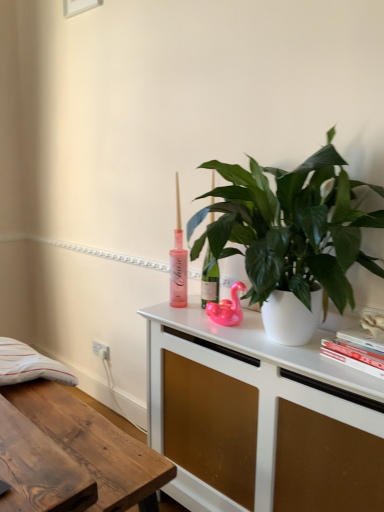
Image resolution: width=384 pixels, height=512 pixels. What do you see at coordinates (290, 234) in the screenshot? I see `green glossy plant at center` at bounding box center [290, 234].

This screenshot has width=384, height=512. What do you see at coordinates (227, 308) in the screenshot?
I see `pink rubber duck at center` at bounding box center [227, 308].

The height and width of the screenshot is (512, 384). What do you see at coordinates (101, 350) in the screenshot?
I see `white plastic electric outlet at lower left` at bounding box center [101, 350].

Identify the location of hardcover book at right. (354, 354).

This screenshot has width=384, height=512. Identify the location of green glossy plant at center. (290, 234).

Which is more to the right, wooden desk at lower left or hardcover book at right?

hardcover book at right.

Which of these two, wooden desk at lower left or hardcover book at right, stands shorter?

Standing shorter between the two is hardcover book at right.

Is wooden desk at lower left aimed at hardcover book at right?

No, wooden desk at lower left is not facing towards hardcover book at right.

Is point (59, 399) closer to camera compared to point (344, 350)?

No, (59, 399) is behind (344, 350).

Is there a large distance between pink rubber duck at center and white matte cabinet at center?

No, pink rubber duck at center is in close proximity to white matte cabinet at center.

From a real-world perspective, between pink rubber duck at center and white matte cabinet at center, who is vertically lower?

white matte cabinet at center, from a real-world perspective.

Between pink rubber duck at center and white matte cabinet at center, which one appears on the left side from the viewer's perspective?

pink rubber duck at center is more to the left.

Measure the distance between pink rubber duck at center and white matte cabinet at center.

A distance of 37.08 centimeters exists between pink rubber duck at center and white matte cabinet at center.

Is white plastic electric outlet at lower left spatially inside pink rubber duck at center, or outside of it?

white plastic electric outlet at lower left is outside pink rubber duck at center.

From the image's perspective, which one is positioned lower, white plastic electric outlet at lower left or pink rubber duck at center?

From the image's view, white plastic electric outlet at lower left is below.

Is white plastic electric outlet at lower left facing towards pink rubber duck at center?

No, white plastic electric outlet at lower left is not turned towards pink rubber duck at center.

Locate an element on the screen. appliance located in front of the white plastic electric outlet at lower left is located at coordinates (227, 308).

Is wooden desk at lower left facing away from white plastic electric outlet at lower left?

Yes.

In the image, is wooden desk at lower left positioned in front of or behind white plastic electric outlet at lower left?

Clearly, wooden desk at lower left is in front of white plastic electric outlet at lower left.

Is wooden desk at lower left positioned beyond the bounds of white plastic electric outlet at lower left?

That's correct, wooden desk at lower left is outside of white plastic electric outlet at lower left.

Are wooden desk at lower left and white plastic electric outlet at lower left located far from each other?

Yes.

Can you confirm if white matte cabinet at center is wider than wooden desk at lower left?

Incorrect, the width of white matte cabinet at center does not surpass that of wooden desk at lower left.

From the image's perspective, is white matte cabinet at center located above or below wooden desk at lower left?

white matte cabinet at center is above wooden desk at lower left.

Relative to wooden desk at lower left, is white matte cabinet at center in front or behind?

In the image, white matte cabinet at center appears in front of wooden desk at lower left.

Find the location of `cabinetry to the right of wooden desk at lower left`. cabinetry to the right of wooden desk at lower left is located at coordinates (259, 418).

Is white plastic electric outlet at lower left at the back of white matte cabinet at center?

No.

Find the location of a particular element. This screenshot has width=384, height=512. electric outlet below the white matte cabinet at center (from a real-world perspective) is located at coordinates (101, 350).

Can you confirm if white matte cabinet at center is positioned to the left of white plastic electric outlet at lower left?

Incorrect, white matte cabinet at center is not on the left side of white plastic electric outlet at lower left.

Does white matte cabinet at center lie in front of white plastic electric outlet at lower left?

Yes, the depth of white matte cabinet at center is less than that of white plastic electric outlet at lower left.

Relative to hardcover book at right, is pink rubber duck at center in front or behind?

In the image, pink rubber duck at center appears behind hardcover book at right.

Is the surface of pink rubber duck at center in direct contact with hardcover book at right?

No, pink rubber duck at center is not with hardcover book at right.

From the image's perspective, which is below, pink rubber duck at center or hardcover book at right?

hardcover book at right.

Who is shorter, pink rubber duck at center or hardcover book at right?

With less height is hardcover book at right.

Find the location of a particular element. Image resolution: width=384 pixels, height=512 pixels. desk below the hardcover book at right (from the image's perspective) is located at coordinates (94, 444).

Identify the location of cabinetry on the right of pink rubber duck at center. (259, 418).

Estimate the real-world distances between objects in this image. Which object is closer to white plastic electric outlet at lower left, green glossy plant at center or pink rubber duck at center?

pink rubber duck at center is positioned closer to the anchor white plastic electric outlet at lower left.

Looking at the image, which one is located closer to white matte cabinet at center, wooden desk at lower left or green glossy plant at center?

green glossy plant at center is positioned closer to the anchor white matte cabinet at center.

Considering their positions, is wooden desk at lower left positioned closer to green glossy plant at center than white matte cabinet at center?

white matte cabinet at center lies closer to green glossy plant at center than the other object.

Looking at this image, looking at the image, which one is located further to white matte cabinet at center, wooden desk at lower left or hardcover book at right?

Based on the image, wooden desk at lower left appears to be further to white matte cabinet at center.

Which object lies further to the anchor point green glossy plant at center, white plastic electric outlet at lower left or wooden desk at lower left?

Based on the image, white plastic electric outlet at lower left appears to be further to green glossy plant at center.

Which object lies further to the anchor point hardcover book at right, white plastic electric outlet at lower left or wooden desk at lower left?

white plastic electric outlet at lower left is positioned further to the anchor hardcover book at right.

Looking at the image, which one is located closer to hardcover book at right, white plastic electric outlet at lower left or green glossy plant at center?

Based on the image, green glossy plant at center appears to be nearer to hardcover book at right.

Looking at the image, which one is located further to pink rubber duck at center, green glossy plant at center or white plastic electric outlet at lower left?

white plastic electric outlet at lower left.

Find the location of `appliance located between green glossy plant at center and white plastic electric outlet at lower left in the depth direction`. appliance located between green glossy plant at center and white plastic electric outlet at lower left in the depth direction is located at coordinates (227, 308).

The image size is (384, 512). Find the location of `desk between white matte cabinet at center and white plastic electric outlet at lower left along the z-axis`. desk between white matte cabinet at center and white plastic electric outlet at lower left along the z-axis is located at coordinates (94, 444).

What are the coordinates of `appliance between wooden desk at lower left and green glossy plant at center from left to right` in the screenshot? It's located at (227, 308).

In order to click on book between pink rubber duck at center and white matte cabinet at center vertically in this screenshot , I will do `click(354, 354)`.